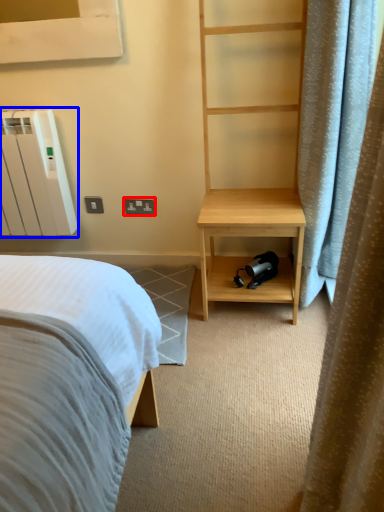
Question: Which object appears farthest to the camera in this image, electric outlet (highlighted by a red box) or radiator (highlighted by a blue box)?

Choices:
 (A) electric outlet
 (B) radiator

Answer: (A)